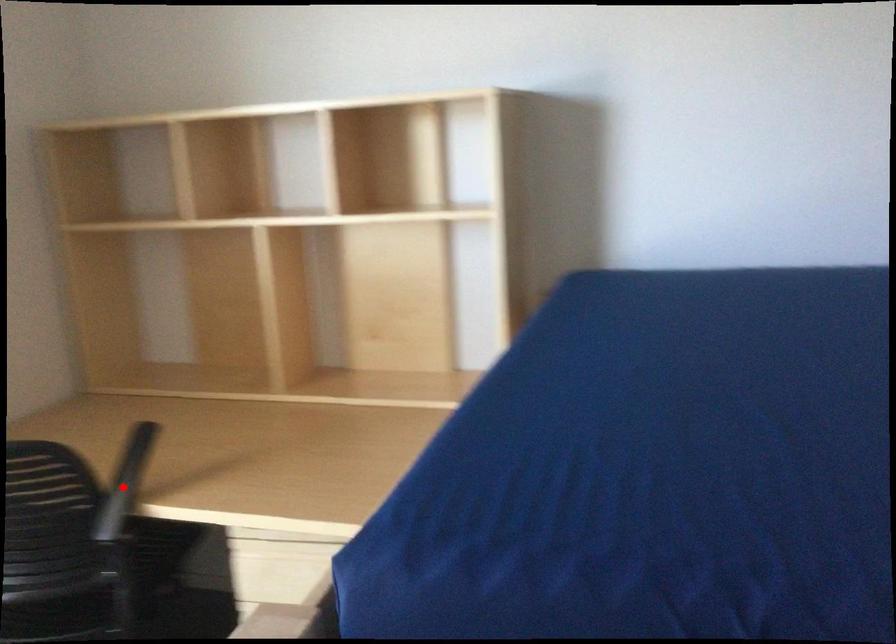
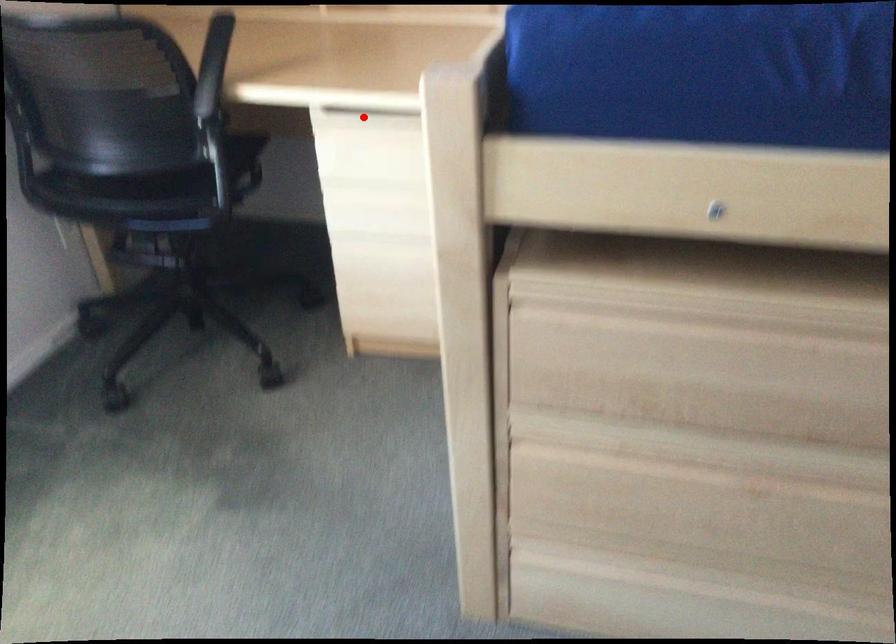
From the picture: I am providing you with two images of the same scene from different viewpoints. A red point is marked on the first image and another point is marked on the second image. Is the marked point in image1 the same physical position as the marked point in image2?

No